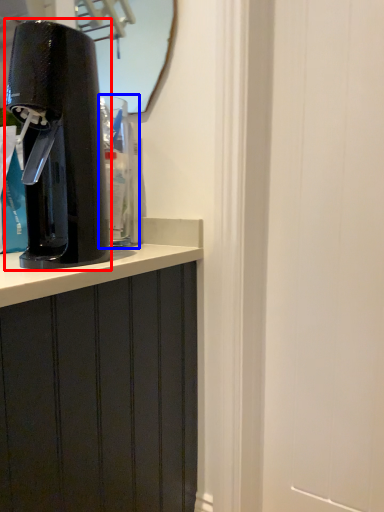
Question: Which point is further to the camera, home appliance (highlighted by a red box) or water cooler (highlighted by a blue box)?

Choices:
 (A) home appliance
 (B) water cooler

Answer: (B)